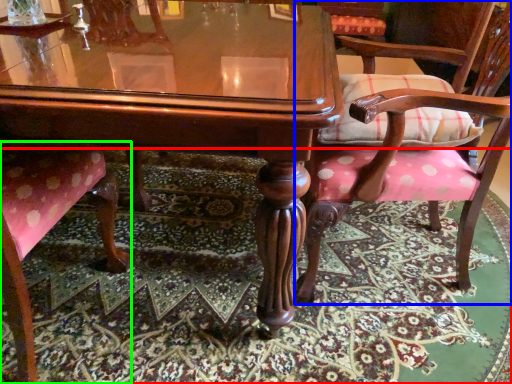
Question: Which object is positioned farthest from mat (highlighted by a red box)? Select from chair (highlighted by a blue box) and chair (highlighted by a green box).

Choices:
 (A) chair
 (B) chair

Answer: (B)